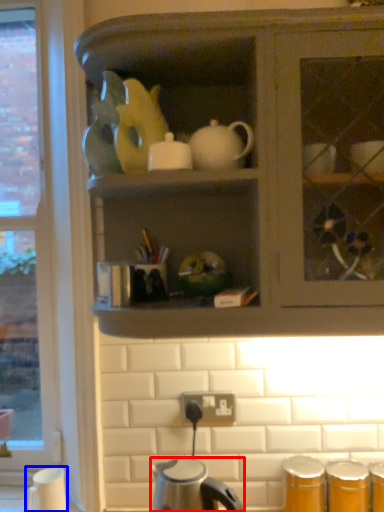
Question: Which object appears closest to the camera in this image, kettle (highlighted by a red box) or coffee cup (highlighted by a blue box)?

Choices:
 (A) kettle
 (B) coffee cup

Answer: (A)